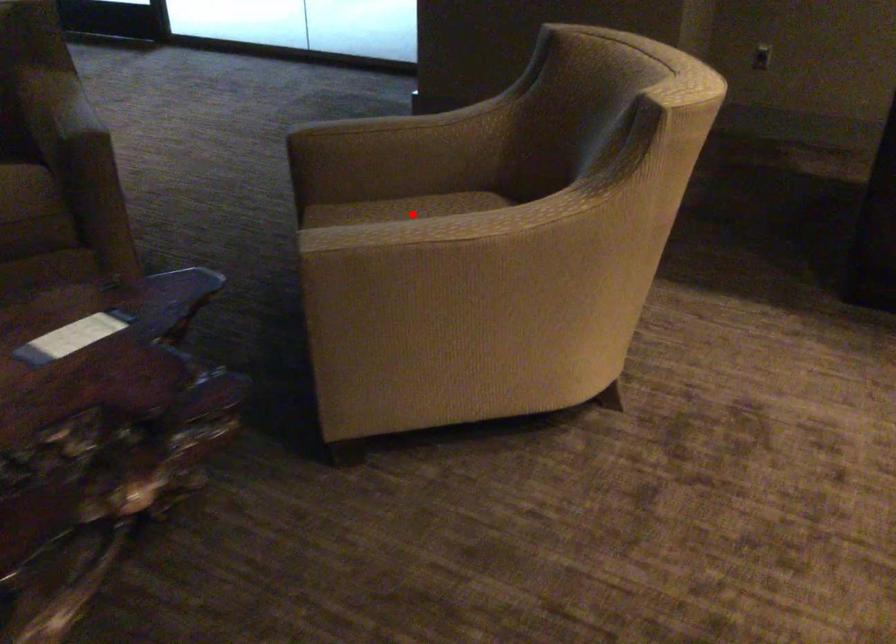
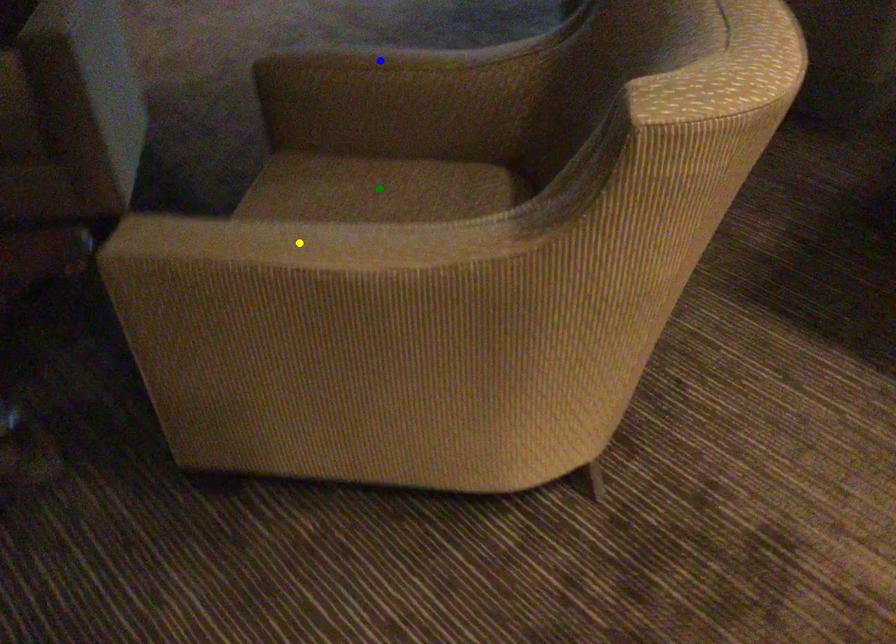
Question: I am providing you with two images of the same scene from different viewpoints. A red point is marked on the first image. You are given multiple points on the second image. Can you choose the point in image 2 that corresponds to the point in image 1?

Choices:
 (A) yellow point
 (B) blue point
 (C) green point

Answer: (C)